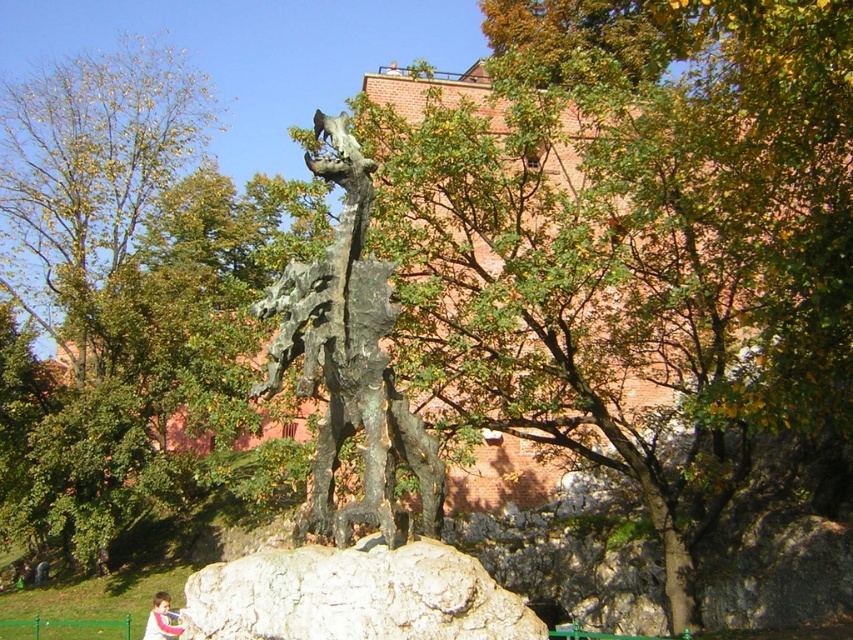
Can you confirm if bronze textured dragon at center is positioned above pink fabric at lower center?

Yes, bronze textured dragon at center is above pink fabric at lower center.

Does bronze textured dragon at center come behind pink fabric at lower center?

No, it is in front of pink fabric at lower center.

Does point (347, 358) lie in front of point (151, 625)?

Yes, it is in front of point (151, 625).

Locate an element on the screen. bronze textured dragon at center is located at coordinates (349, 360).

Is gray rough rock at center to the right of pink fabric at lower center from the viewer's perspective?

Correct, you'll find gray rough rock at center to the right of pink fabric at lower center.

Is gray rough rock at center positioned in front of pink fabric at lower center?

Yes, it is in front of pink fabric at lower center.

Is point (343, 602) positioned in front of point (149, 632)?

That is True.

Image resolution: width=853 pixels, height=640 pixels. Identify the location of gray rough rock at center. point(354,595).

Is bronze textured dragon at center taller than gray rough rock at center?

Yes, bronze textured dragon at center is taller than gray rough rock at center.

Is point (281, 298) more distant than point (363, 557)?

Yes, point (281, 298) is behind point (363, 557).

Where is `bronze textured dragon at center`? bronze textured dragon at center is located at coordinates (349, 360).